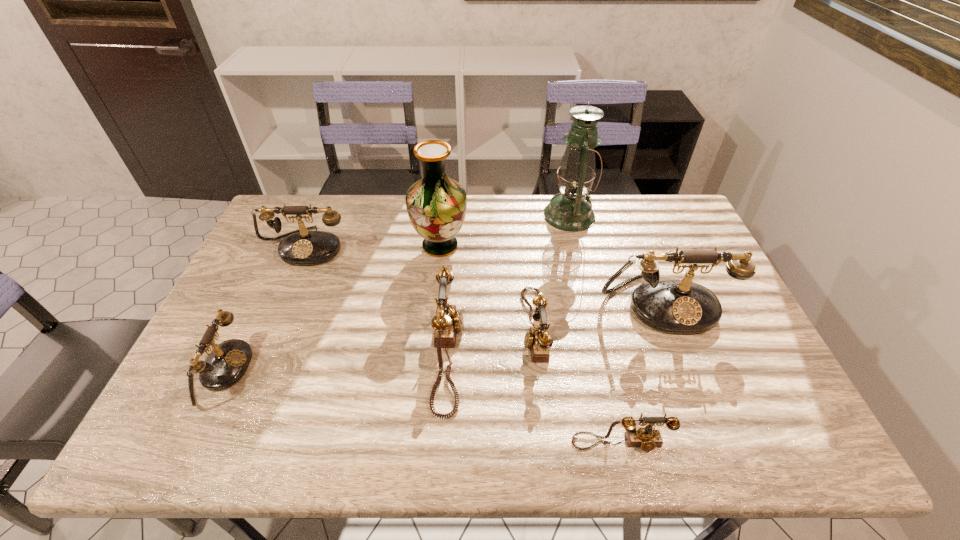
What are the coordinates of `oil lamp` in the screenshot? It's located at (570, 210).

The width and height of the screenshot is (960, 540). Find the location of `the second tallest object`. the second tallest object is located at coordinates (436, 204).

At what (x,y) coordinates should I click in order to perform the action: click on the biggest black telephone. Please return your answer as a coordinate pair (x, y). The width and height of the screenshot is (960, 540). Looking at the image, I should click on (675, 306).

Find the location of a particular element. The width and height of the screenshot is (960, 540). the second nearest black telephone is located at coordinates (675, 306).

The width and height of the screenshot is (960, 540). In order to click on the farthest black telephone in this screenshot , I will do `click(300, 247)`.

The height and width of the screenshot is (540, 960). I want to click on the farthest telephone, so click(x=300, y=247).

This screenshot has height=540, width=960. In order to click on the fourth telephone from right to left in this screenshot , I will do `click(448, 320)`.

At what (x,y) coordinates should I click in order to perform the action: click on the leftmost brown telephone. Please return your answer as a coordinate pair (x, y). The image size is (960, 540). Looking at the image, I should click on (448, 320).

This screenshot has height=540, width=960. I want to click on the fifth object from left to right, so click(537, 339).

Locate an element on the screen. the second biggest brown telephone is located at coordinates (537, 339).